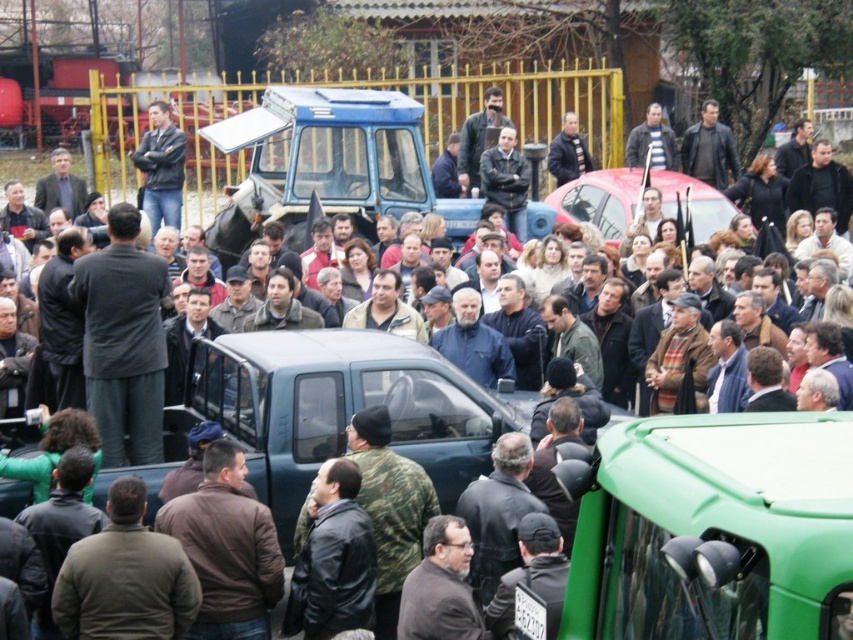
Between point (155, 465) and point (720, 218), which one is positioned behind?

The point (720, 218) is more distant.

Is matte black truck at center below metallic red car at center?

Indeed, matte black truck at center is positioned under metallic red car at center.

Does point (456, 468) come farther from viewer compared to point (590, 180)?

No, (456, 468) is closer to viewer.

At what (x,y) coordinates should I click in order to perform the action: click on matte black truck at center. Please return your answer as a coordinate pair (x, y). The height and width of the screenshot is (640, 853). Looking at the image, I should click on (328, 412).

Does point (508, 150) come farther from viewer compared to point (582, 145)?

No, it is not.

Looking at this image, can you confirm if dark brown leather jacket at center is shorter than dark blue jacket at center?

In fact, dark brown leather jacket at center may be taller than dark blue jacket at center.

Does point (494, 172) come farther from viewer compared to point (555, 144)?

That is False.

Locate an element on the screen. Image resolution: width=853 pixels, height=640 pixels. dark brown leather jacket at center is located at coordinates (506, 180).

This screenshot has height=640, width=853. I want to click on dark brown leather jacket at upper center, so click(x=479, y=138).

Who is more forward, [465,166] or [657,164]?

Point [465,166] is more forward.

Between point (485, 145) and point (634, 145), which one is positioned in front?

Point (485, 145) is more forward.

Where is `dark brown leather jacket at upper center`? This screenshot has height=640, width=853. dark brown leather jacket at upper center is located at coordinates (479, 138).